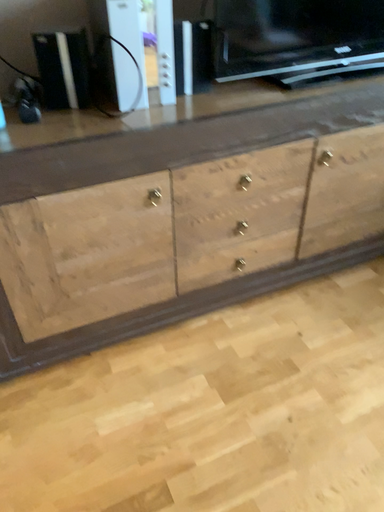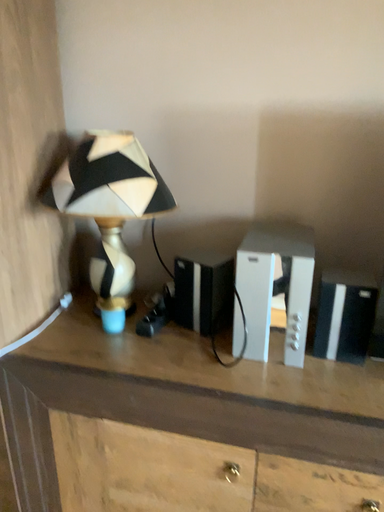
Question: How did the camera likely rotate when shooting the video?

Choices:
 (A) rotated left
 (B) rotated right

Answer: (A)